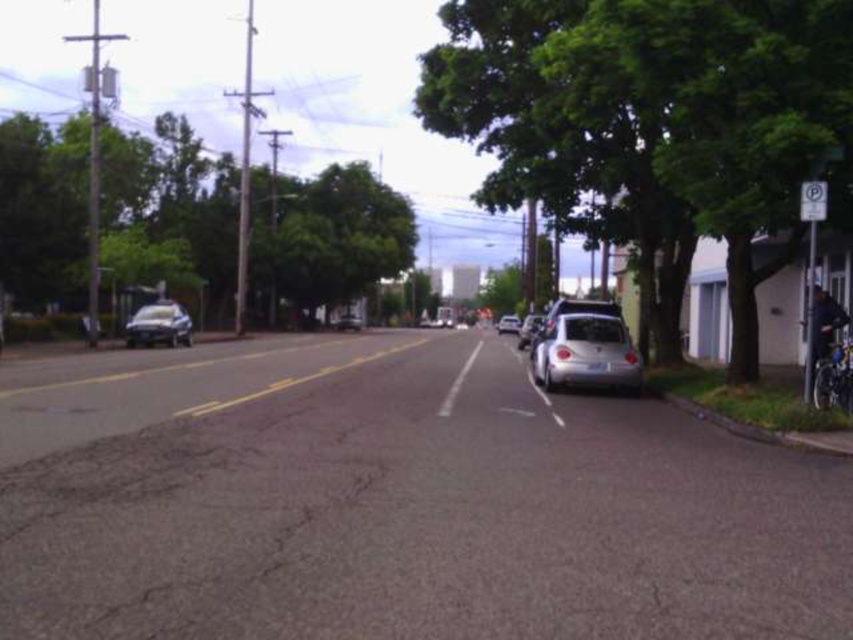
In the scene shown: Between green leafy tree at left and satin silver sedan at left, which one is positioned higher?

green leafy tree at left is above.

In the scene shown: Who is more distant from viewer, (264,179) or (175,317)?

The point (264,179) is behind.

Is point (383, 253) farther from camera compared to point (187, 320)?

Yes, it is behind point (187, 320).

Find the location of `green leafy tree at left`. green leafy tree at left is located at coordinates (167, 211).

Does satin silver car at right appear under silver metallic car at center?

No.

Which is below, satin silver car at right or silver metallic car at center?

silver metallic car at center is lower down.

Locate an element on the screen. satin silver car at right is located at coordinates (585, 353).

Can you confirm if silver metallic hatchback at right is taller than silver metallic car at center?

Indeed, silver metallic hatchback at right has a greater height compared to silver metallic car at center.

Is point (521, 342) positioned after point (497, 332)?

No, it is in front of (497, 332).

Is point (523, 339) in front of point (503, 324)?

Yes, point (523, 339) is closer to viewer.

This screenshot has height=640, width=853. I want to click on silver metallic hatchback at right, so click(527, 328).